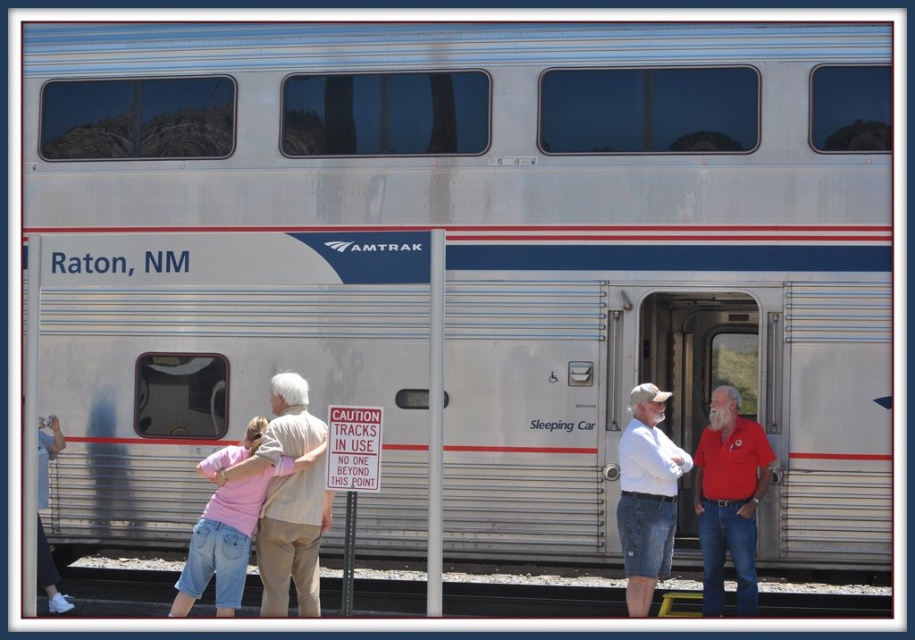
Question: Is red cotton shirt at right thinner than denim shorts at center?

Choices:
 (A) yes
 (B) no

Answer: (A)

Question: Which of the following is the farthest from the observer?

Choices:
 (A) (644, 419)
 (B) (167, 588)
 (C) (283, 420)

Answer: (B)

Question: Which of the following is the farthest from the observer?

Choices:
 (A) gray gravel at lower center
 (B) red cotton shirt at right

Answer: (A)

Question: Can you confirm if denim shorts at center is positioned above white shirt at left?

Choices:
 (A) no
 (B) yes

Answer: (B)

Question: Which point is closer to the camera?

Choices:
 (A) pink fabric shirt at left
 (B) denim shorts at center
 (C) red cotton shirt at right

Answer: (A)

Question: Can you confirm if pink fabric shirt at left is wider than red cotton shirt at right?

Choices:
 (A) no
 (B) yes

Answer: (B)